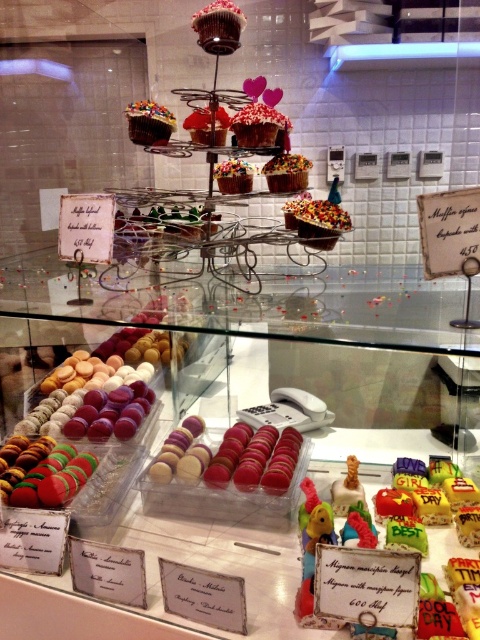
Question: Can you confirm if sprinkled white cupcake at center is smaller than shiny chocolate cupcake at center?

Choices:
 (A) yes
 (B) no

Answer: (A)

Question: Which object appears closest to the camera in this image?

Choices:
 (A) sprinkled white cupcake at center
 (B) glazed chocolate cupcake at upper center
 (C) multicolored sprinkles cupcake at center

Answer: (A)

Question: Can you confirm if multicolored macarons at lower left is bigger than sprinkled chocolate cupcake at center?

Choices:
 (A) yes
 (B) no

Answer: (A)

Question: Which point appears farthest from the camera in this image?

Choices:
 (A) coord(255,104)
 (B) coord(224,188)
 (C) coord(201,125)
 (D) coord(276,182)

Answer: (B)

Question: Observing the image, what is the correct spatial positioning of multicolored macarons at lower left in reference to glazed chocolate cupcake at center?

Choices:
 (A) below
 (B) above

Answer: (A)

Question: Estimate the real-world distances between objects in this image. Which object is farther from the sprinkled chocolate cupcake at center?

Choices:
 (A) multicolored macarons at lower left
 (B) shiny chocolate cupcake at center
 (C) sprinkled white cupcake at center

Answer: (A)